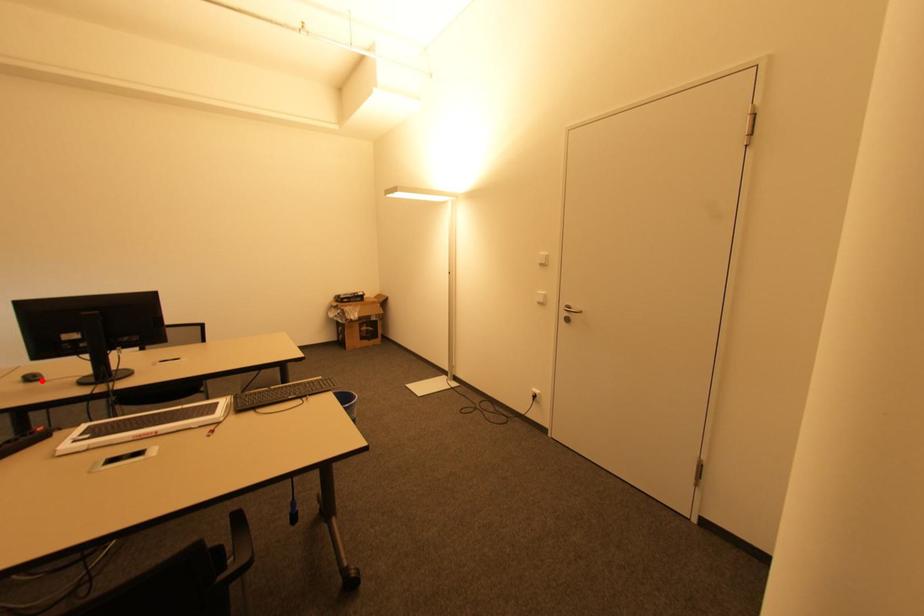
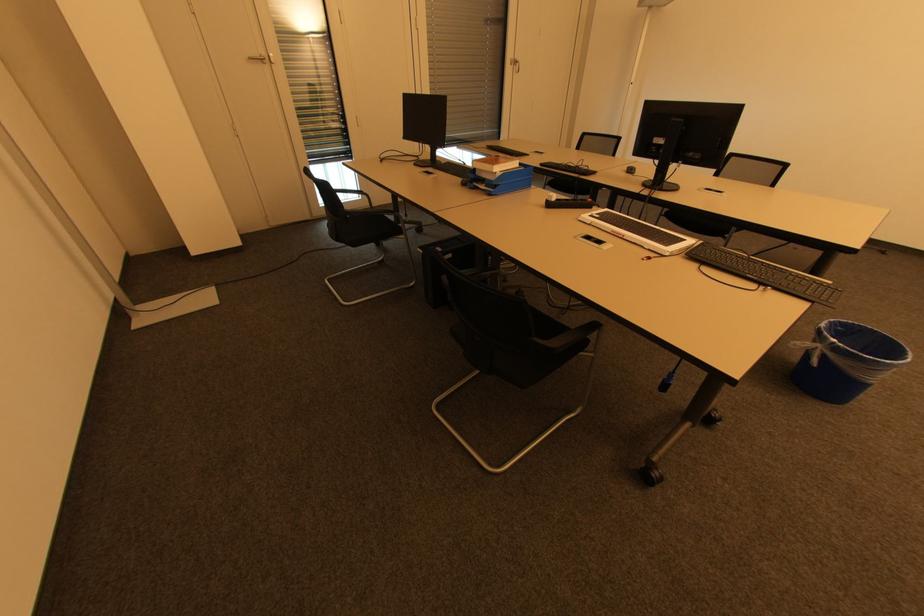
In the second image, find the point that corresponds to the highlighted location in the first image.

(634, 174)